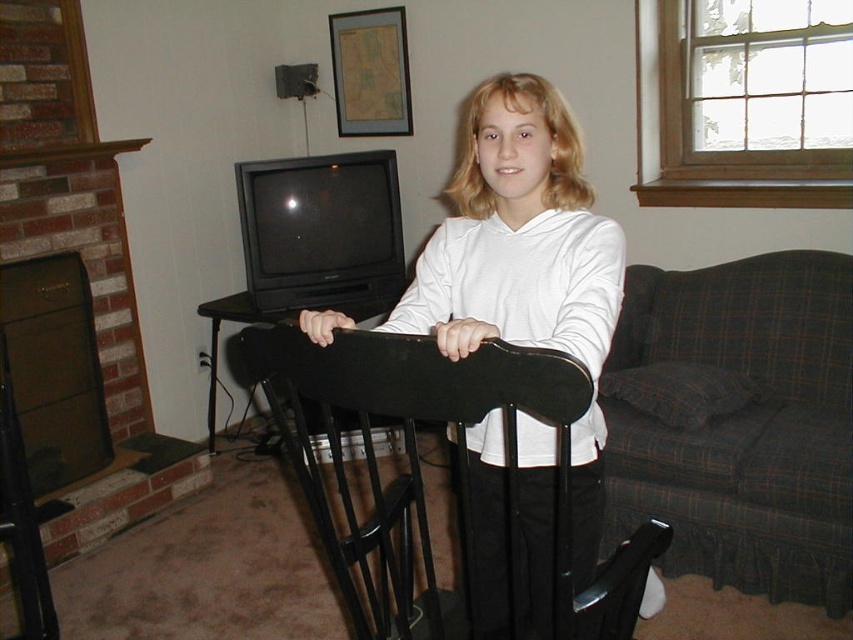
Question: Which object is farther from the camera taking this photo?

Choices:
 (A) black wood rocking chair at center
 (B) white matte hoodie at center

Answer: (B)

Question: Where is white matte hoodie at center located in relation to black wood rocking chair at center in the image?

Choices:
 (A) below
 (B) above

Answer: (B)

Question: Is white matte hoodie at center above black wood rocking chair at center?

Choices:
 (A) yes
 (B) no

Answer: (A)

Question: Considering the relative positions of white matte hoodie at center and black wood rocking chair at center in the image provided, where is white matte hoodie at center located with respect to black wood rocking chair at center?

Choices:
 (A) above
 (B) below

Answer: (A)

Question: Which point appears closest to the camera in this image?

Choices:
 (A) (312, 500)
 (B) (608, 333)

Answer: (A)